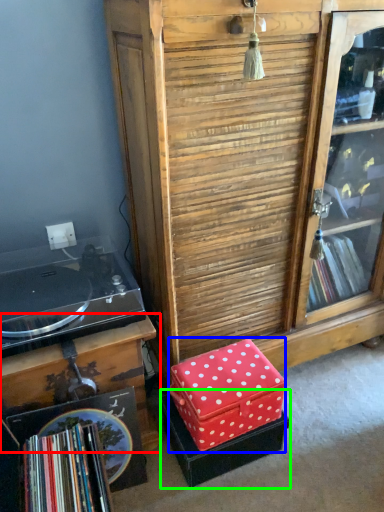
Question: Considering the real-world distances, which object is farthest from table (highlighted by a red box)? storage box (highlighted by a blue box) or storage box (highlighted by a green box)?

Choices:
 (A) storage box
 (B) storage box

Answer: (B)